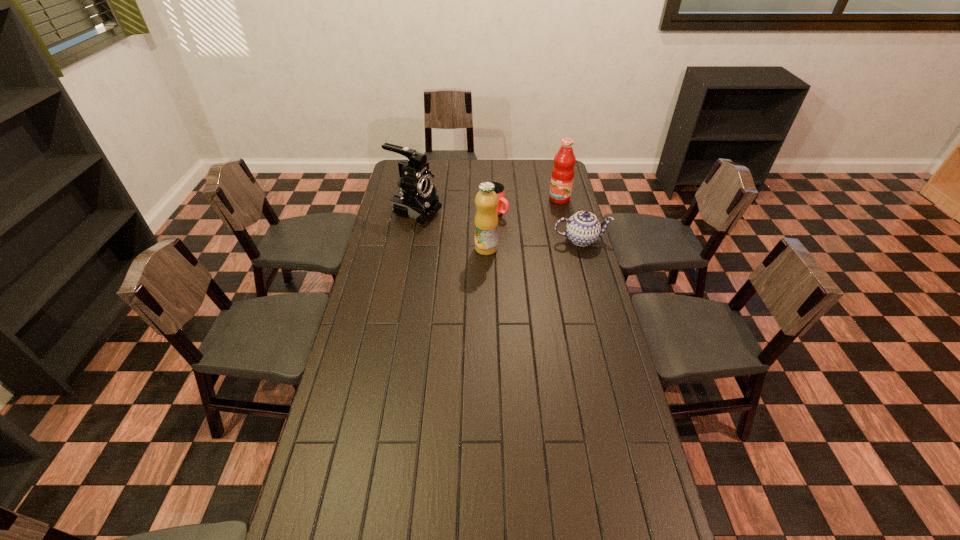
Locate an element on the screen. The image size is (960, 540). vacant space located 0.350m on the front label of the farther fruit juice is located at coordinates (522, 243).

In order to click on free space located on the front label of the farther fruit juice in this screenshot , I will do `click(516, 249)`.

Find the location of `vacant space positioned on the front label of the farther fruit juice`. vacant space positioned on the front label of the farther fruit juice is located at coordinates (548, 212).

Locate an element on the screen. The image size is (960, 540). blank space located 0.090m on the handle side of the cup is located at coordinates pos(518,227).

Find the location of a particular element. free space located on the handle side of the cup is located at coordinates (559, 250).

Locate an element on the screen. Image resolution: width=960 pixels, height=540 pixels. vacant space situated 0.270m on the handle side of the cup is located at coordinates (550, 245).

You are a GUI agent. You are given a task and a screenshot of the screen. Output one action in this format:
    pyautogui.click(x=<x>, y=<y>)
    Task: Click on the object that is at the left edge
    
    Given the screenshot: What is the action you would take?
    pyautogui.click(x=417, y=198)

Where is `chinaware that is at the right edge`? chinaware that is at the right edge is located at coordinates (583, 228).

The width and height of the screenshot is (960, 540). I want to click on fruit juice that is positioned at the right edge, so click(562, 177).

I want to click on vacant space at the left edge of the desktop, so click(x=392, y=287).